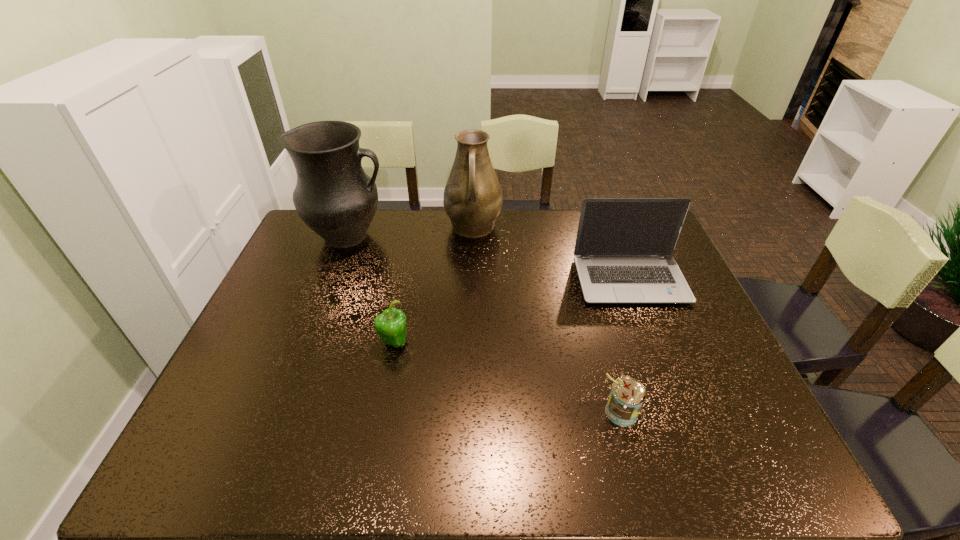
Find the location of `the leftmost object`. the leftmost object is located at coordinates (333, 196).

This screenshot has width=960, height=540. Find the location of `the right pitcher`. the right pitcher is located at coordinates (472, 200).

This screenshot has height=540, width=960. I want to click on the third tallest object, so click(x=623, y=252).

Image resolution: width=960 pixels, height=540 pixels. What are the coordinates of `the fourth object from right to left` in the screenshot? It's located at (390, 325).

I want to click on bell pepper, so click(x=390, y=325).

Where is `the nearest object`? The height and width of the screenshot is (540, 960). the nearest object is located at coordinates (627, 397).

The height and width of the screenshot is (540, 960). I want to click on blank space located on the handle side of the leftmost object, so click(x=411, y=236).

At what (x,y) coordinates should I click in order to perform the action: click on vacant space located 0.140m on the handle side of the third object from left to right. Please return your answer as a coordinate pair (x, y). This screenshot has width=960, height=540. Looking at the image, I should click on (472, 275).

Where is `vacant region located on the screen of the third shortest object`? The height and width of the screenshot is (540, 960). vacant region located on the screen of the third shortest object is located at coordinates (656, 348).

Find the location of `free point located 0.350m on the right of the bell pepper`. free point located 0.350m on the right of the bell pepper is located at coordinates (544, 342).